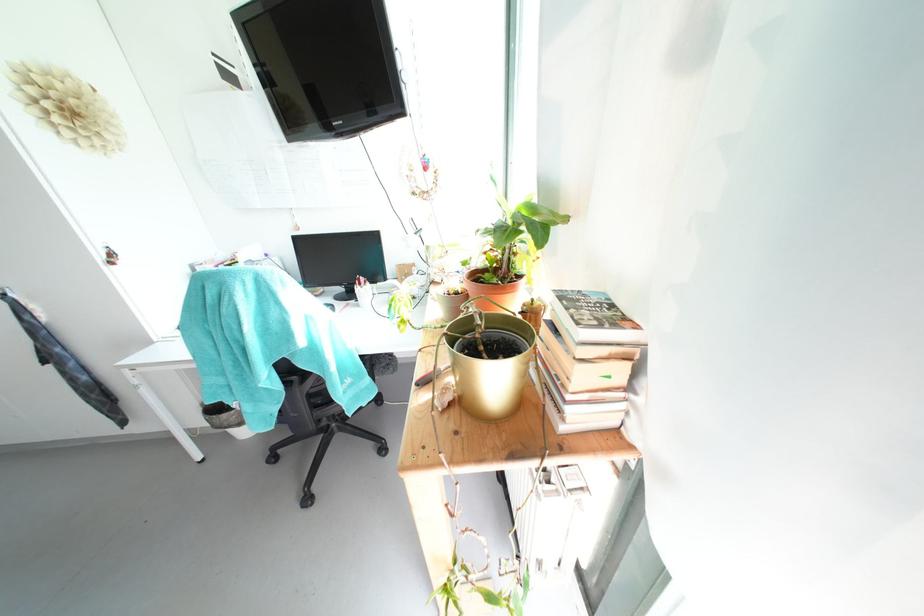
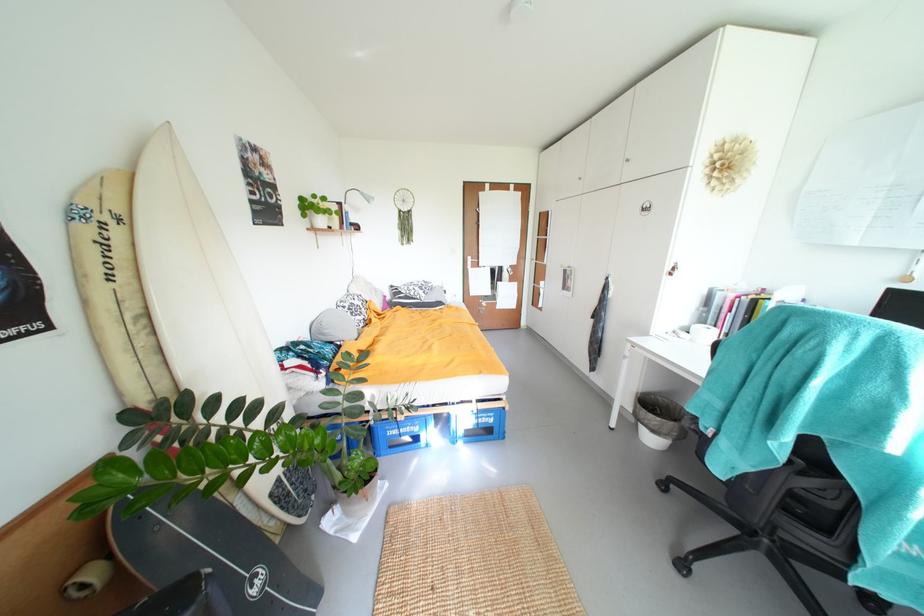
Where in the second image is the point corresponding to pixel 108 259 from the first image?

(675, 270)